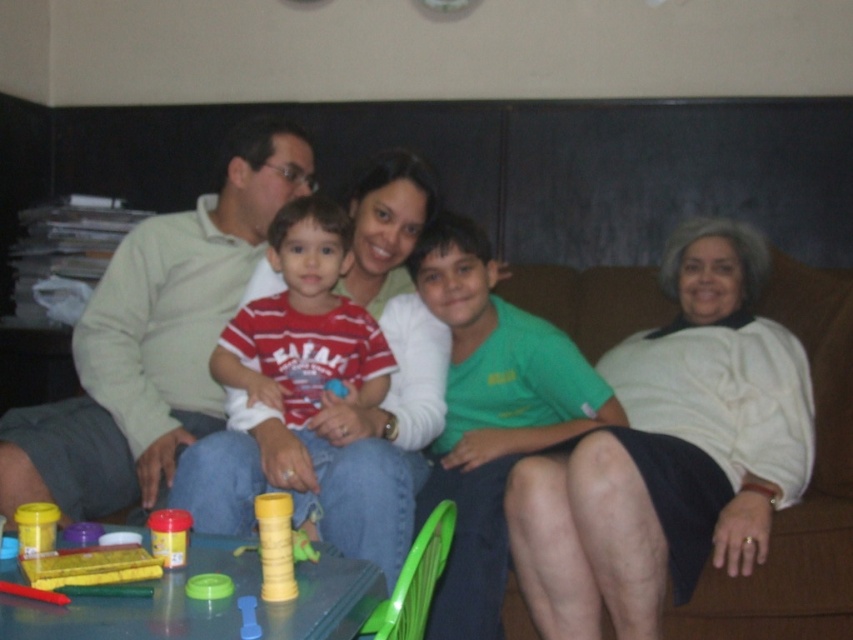
Question: Is plastic toy at lower left positioned in front of smooth plastic cup at lower left?

Choices:
 (A) yes
 (B) no

Answer: (A)

Question: Does plastic toy at lower left appear under matte yellow cup at lower left?

Choices:
 (A) no
 (B) yes

Answer: (B)

Question: Is the position of yellow matte tower at center less distant than that of matte plastic container at lower left?

Choices:
 (A) no
 (B) yes

Answer: (B)

Question: Which is nearer to the matte yellow cup at lower left?

Choices:
 (A) matte plastic container at lower left
 (B) white sweater at center

Answer: (A)

Question: Among these objects, which one is nearest to the camera?

Choices:
 (A) matte plastic container at lower left
 (B) matte yellow cup at lower left
 (C) plastic toy at lower left

Answer: (C)

Question: Which of the following is the farthest from the observer?

Choices:
 (A) matte green shirt at center
 (B) striped cotton shirt at center
 (C) matte yellow cup at lower left

Answer: (B)